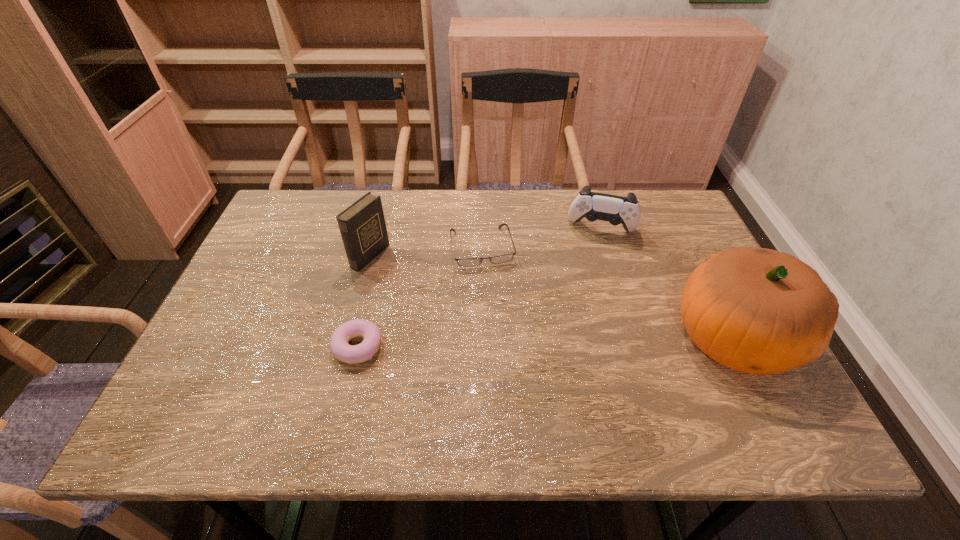
Identify the location of object that is at the near right corner. This screenshot has height=540, width=960. (759, 311).

Where is `vacant space at the far edge of the desktop`? The width and height of the screenshot is (960, 540). vacant space at the far edge of the desktop is located at coordinates (548, 201).

You are a GUI agent. You are given a task and a screenshot of the screen. Output one action in this format:
    pyautogui.click(x=<x>, y=<y>)
    Task: Click on the blank space at the near edge
    
    Given the screenshot: What is the action you would take?
    pyautogui.click(x=396, y=371)

Find the location of a particular element. The image size is (960, 540). vacant space at the left edge of the desktop is located at coordinates click(x=223, y=326).

Locate an element on the screen. Image resolution: width=960 pixels, height=540 pixels. vacant area at the near left corner is located at coordinates (211, 381).

The height and width of the screenshot is (540, 960). I want to click on blank space at the far right corner of the desktop, so click(667, 218).

In the image, there is a desktop. Where is `vacant space at the near right corner`? This screenshot has width=960, height=540. vacant space at the near right corner is located at coordinates (717, 385).

Locate an element on the screen. free space between the doughnut and the control is located at coordinates (480, 288).

Where is `vacant point located between the pumpkin and the control`? vacant point located between the pumpkin and the control is located at coordinates (668, 284).

Find the location of `free space between the control and the doughnut`. free space between the control and the doughnut is located at coordinates (480, 288).